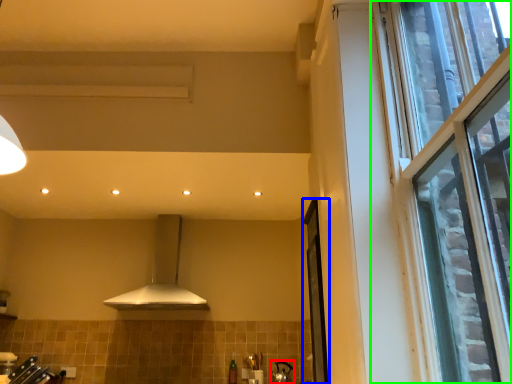
Question: Which object is positioned farthest from appliance (highlighted by a red box)? Select from screen door (highlighted by a blue box) and window (highlighted by a green box).

Choices:
 (A) screen door
 (B) window

Answer: (B)